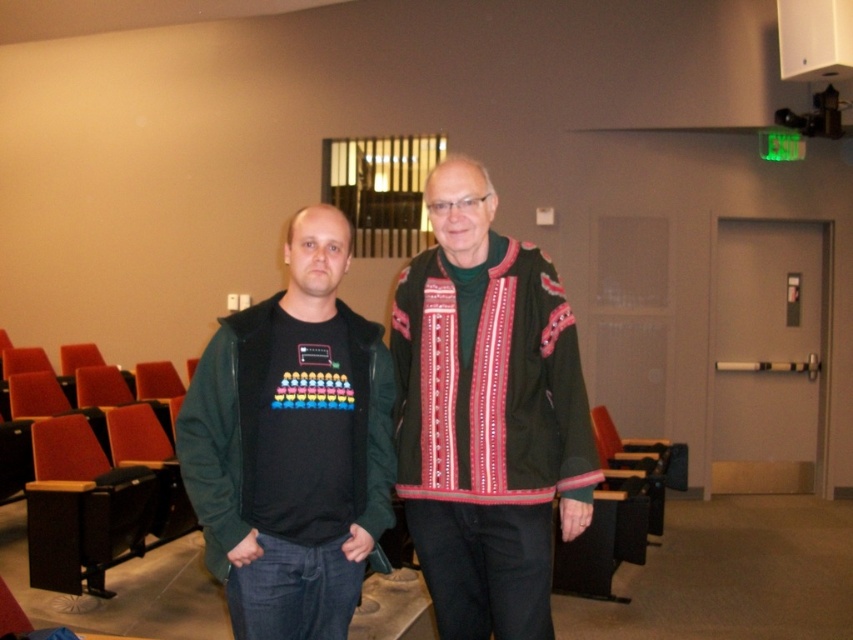
Does dark green textured jacket at center appear under green fleece vest at center?

Correct, dark green textured jacket at center is located below green fleece vest at center.

Between dark green textured jacket at center and green fleece vest at center, which one has less height?

With less height is green fleece vest at center.

You are a GUI agent. You are given a task and a screenshot of the screen. Output one action in this format:
    pyautogui.click(x=<x>, y=<y>)
    Task: Click on the dark green textured jacket at center
    
    Given the screenshot: What is the action you would take?
    pyautogui.click(x=293, y=445)

This screenshot has height=640, width=853. What are the coordinates of `dark green textured jacket at center` in the screenshot? It's located at (293, 445).

Is dark green textured jacket at center behind dark green woolen sweater at center?

No, dark green textured jacket at center is in front of dark green woolen sweater at center.

Does dark green textured jacket at center have a lesser width compared to dark green woolen sweater at center?

In fact, dark green textured jacket at center might be wider than dark green woolen sweater at center.

Measure the distance between dark green textured jacket at center and camera.

They are 1.95 meters apart.

The width and height of the screenshot is (853, 640). Identify the location of dark green textured jacket at center. (293, 445).

Can you confirm if dark green woolen sweater at center is positioned above green fleece vest at center?

Correct, dark green woolen sweater at center is located above green fleece vest at center.

At what (x,y) coordinates should I click in order to perform the action: click on dark green woolen sweater at center. Please return your answer as a coordinate pair (x, y). The width and height of the screenshot is (853, 640). Looking at the image, I should click on (489, 381).

This screenshot has height=640, width=853. I want to click on dark green woolen sweater at center, so click(489, 381).